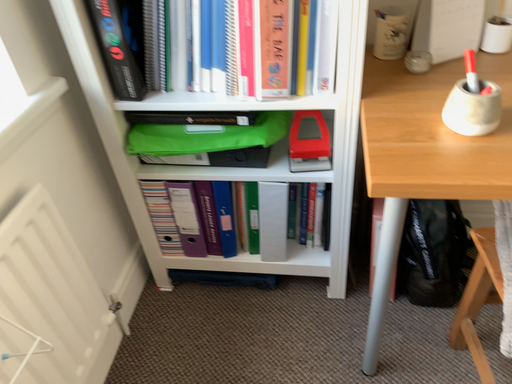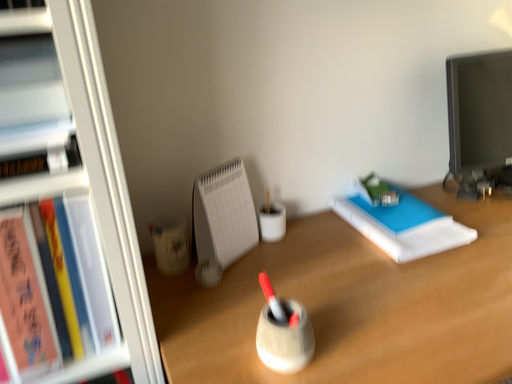
Question: How did the camera likely rotate when shooting the video?

Choices:
 (A) rotated upward
 (B) rotated downward

Answer: (A)